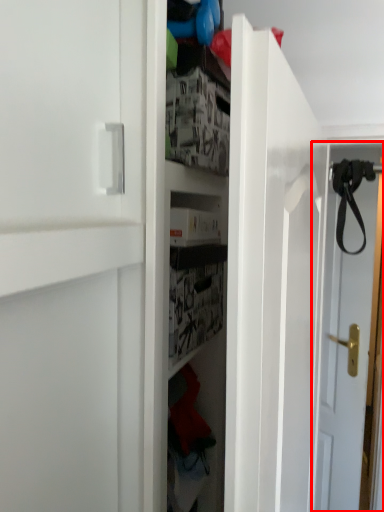
Question: From the image, what is the correct spatial relationship of door (annotated by the red box) in relation to strap?

Choices:
 (A) left
 (B) right

Answer: (B)